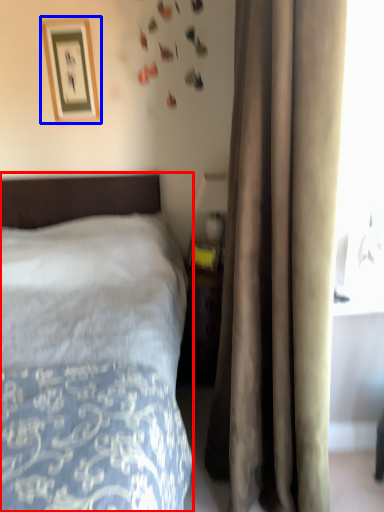
Question: Which of the following is the closest to the observer, bed (highlighted by a red box) or picture frame (highlighted by a blue box)?

Choices:
 (A) bed
 (B) picture frame

Answer: (A)